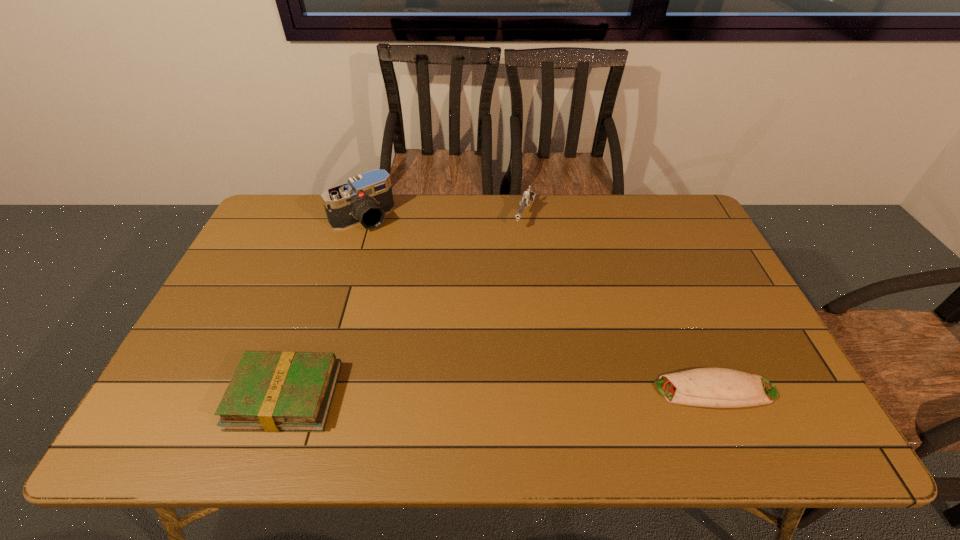
Locate an element on the screen. free space on the desktop that is between the third tallest object and the shortest object and is positioned on the front-facing side of the tallest object is located at coordinates (506, 393).

Locate an element on the screen. The image size is (960, 540). free space on the desktop that is between the book and the shortest object and is positioned aimed along the barrel of the second tallest object is located at coordinates 446,394.